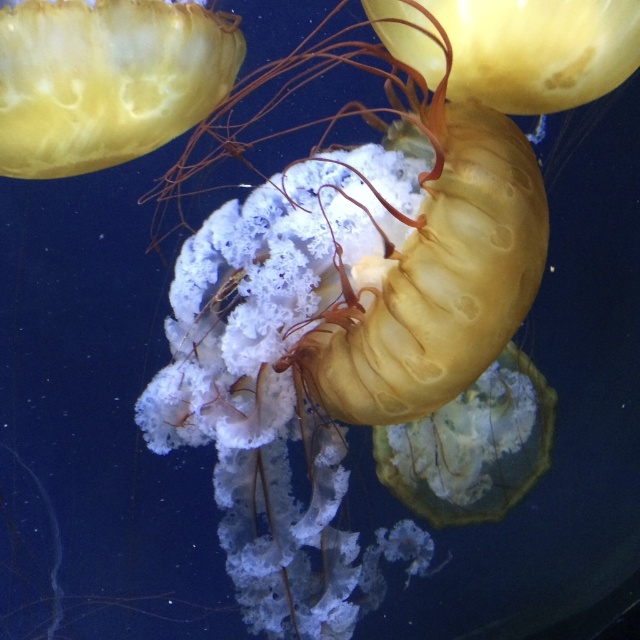
You are an aquarium visitor observing the jellyfish tank. You notice two translucent yellow jellyfish at upper left and translucent yellow jellyfish at upper center. Which one appears closer to you?

The translucent yellow jellyfish at upper left appears closer to you because it is in front of the translucent yellow jellyfish at upper center.

You are observing the aquarium from the front. There are two points marked in the image, point1 at coordinate point(152, 4) and point2 at coordinate point(456, 42). Which point is closer to the front of the aquarium?

Point2 at coordinate point(456, 42) is closer to the front of the aquarium because it is in front of point1 at coordinate point(152, 4).